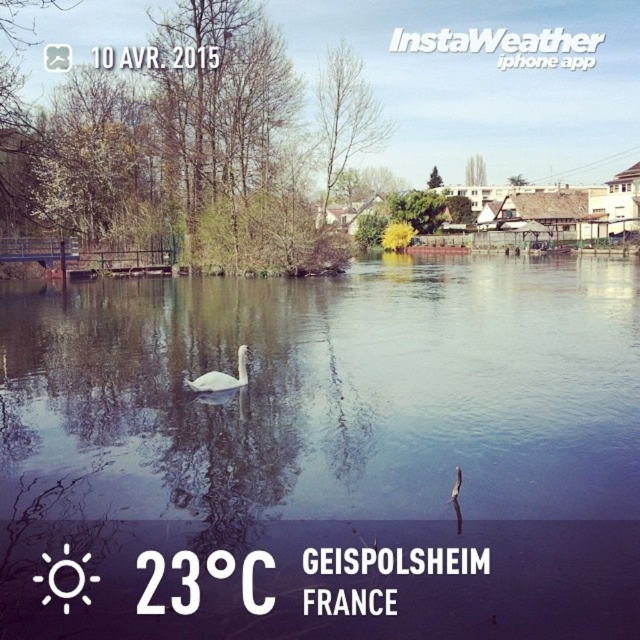
Based on the photo, what is located at the coordinates point (326,452) in the image?

At point (326,452) lies clear water at center.

You are a photographer trying to capture the swan in the center of the lake. You notice two points marked on your camera screen at coordinates point [221,365] and point [205,387]. Which point is closer to the swan?

Point [205,387] is closer to the swan because it is in front of point [221,365], which is behind it.

You are planning to take a photo of the clear water at center and the white glossy swan at center from the lakeside. Which object will appear wider in your photo?

The clear water at center will appear wider in the photo because its width is larger than that of the white glossy swan at center.